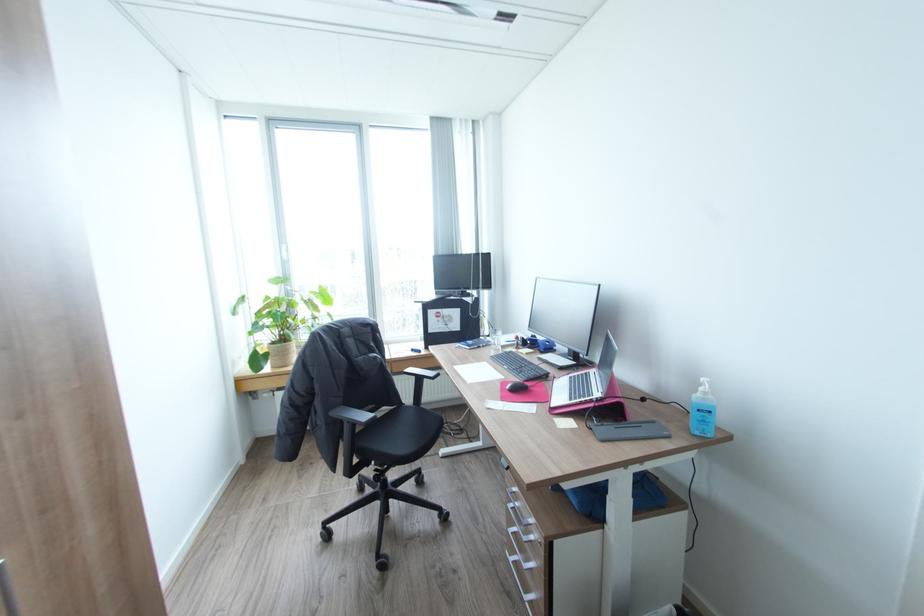
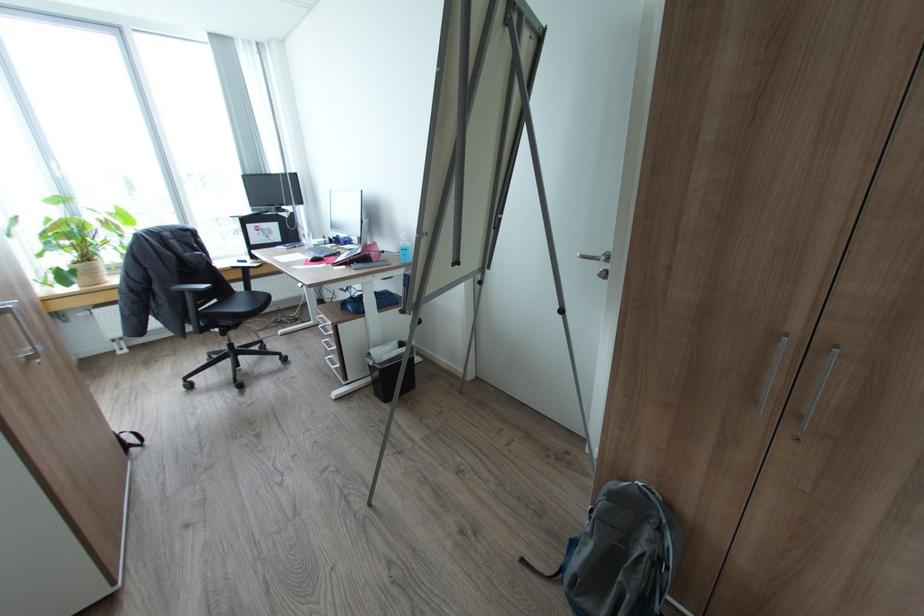
Where in the second image is the point corresponding to the point at 412,407 from the first image?

(246, 292)